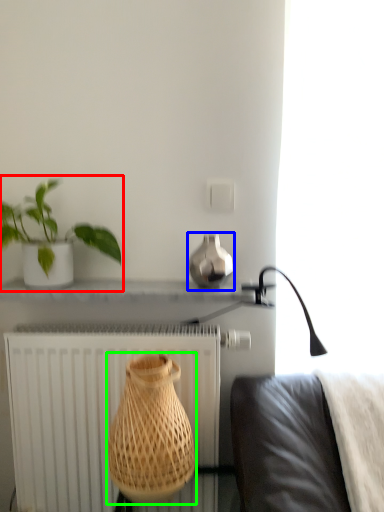
Question: Which object is the farthest from houseplant (highlighted by a red box)? Choose among these: vase (highlighted by a blue box) or vase (highlighted by a green box).

Choices:
 (A) vase
 (B) vase

Answer: (B)